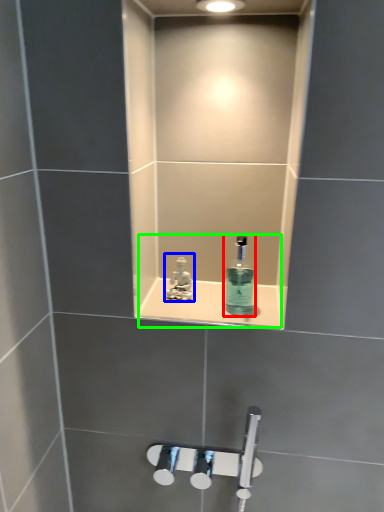
Question: Which object is the farthest from mouthwash (highlighted by a red box)? Choose among these: tap (highlighted by a blue box) or sink (highlighted by a green box).

Choices:
 (A) tap
 (B) sink

Answer: (A)